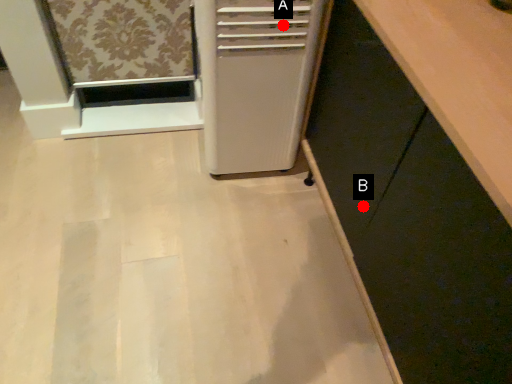
Question: Two points are circled on the image, labeled by A and B beside each circle. Which of the following is the closest to the observer?

Choices:
 (A) A is closer
 (B) B is closer

Answer: (B)